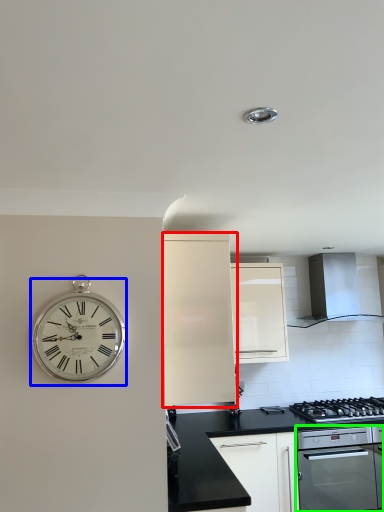
Question: Which object is the farthest from cabinetry (highlighted by a red box)? Choose among these: wall clock (highlighted by a blue box) or oven (highlighted by a green box).

Choices:
 (A) wall clock
 (B) oven

Answer: (B)